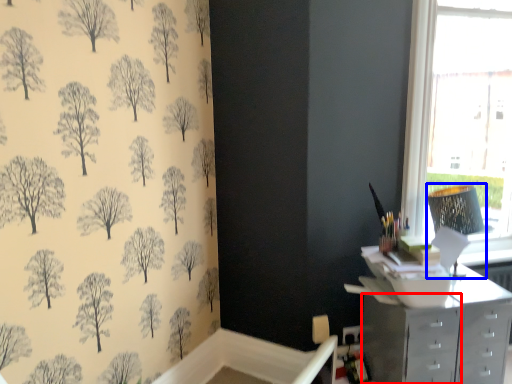
Question: Which object is closer to the camera taking this photo, file cabinet (highlighted by a red box) or lamp (highlighted by a blue box)?

Choices:
 (A) file cabinet
 (B) lamp

Answer: (A)